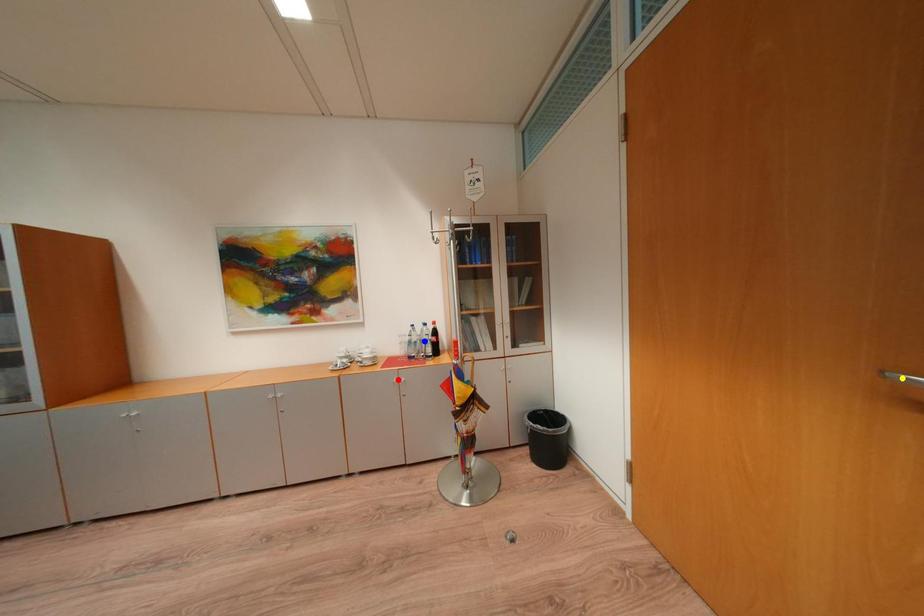
Order these from nearest to farthest:
blue point
red point
yellow point

blue point
red point
yellow point